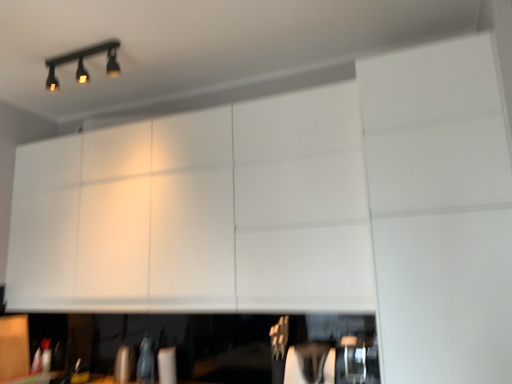
Question: Visually, is black matte track light at upper left positioned to the left or to the right of matte wood cabinet at lower left, acting as the 2th cabinetry starting from the right?

Choices:
 (A) right
 (B) left

Answer: (A)

Question: Is black matte track light at upper left taller or shorter than matte wood cabinet at lower left, which is the 1th cabinetry in left-to-right order?

Choices:
 (A) tall
 (B) short

Answer: (B)

Question: Which of these objects is positioned closest to the matte wood cabinet at lower left, which is the 1th cabinetry in left-to-right order?

Choices:
 (A) white matte cabinet at upper center, positioned as the first cabinetry in top-to-bottom order
 (B) black matte track light at upper left

Answer: (A)

Question: Which object is the farthest from the matte wood cabinet at lower left, which is the 1th cabinetry in left-to-right order?

Choices:
 (A) white matte cabinet at upper center, the second cabinetry when ordered from bottom to top
 (B) black matte track light at upper left

Answer: (B)